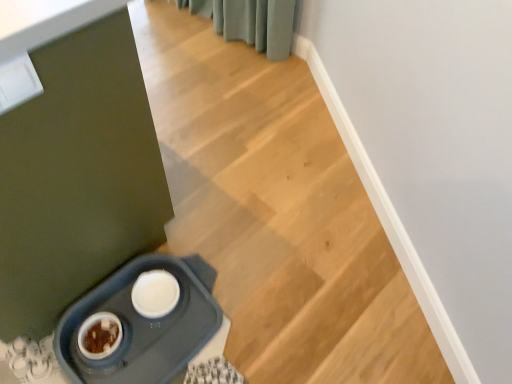
Question: Considering the positions of wooden stairs at center and matte plastic pet feeder at lower left in the image, is wooden stairs at center taller or shorter than matte plastic pet feeder at lower left?

Choices:
 (A) short
 (B) tall

Answer: (A)

Question: Is point (300, 230) closer or farther from the camera than point (97, 307)?

Choices:
 (A) closer
 (B) farther

Answer: (B)

Question: Considering their positions, is wooden stairs at center located in front of or behind matte plastic pet feeder at lower left?

Choices:
 (A) behind
 (B) front

Answer: (B)

Question: Is point (187, 299) positioned closer to the camera than point (289, 59)?

Choices:
 (A) farther
 (B) closer

Answer: (B)

Question: From a real-world perspective, is matte plastic pet feeder at lower left above or below wooden stairs at center?

Choices:
 (A) above
 (B) below

Answer: (A)

Question: Choose the correct answer: Is matte plastic pet feeder at lower left inside wooden stairs at center or outside it?

Choices:
 (A) inside
 (B) outside

Answer: (B)

Question: Considering their positions, is matte plastic pet feeder at lower left located in front of or behind wooden stairs at center?

Choices:
 (A) front
 (B) behind

Answer: (B)